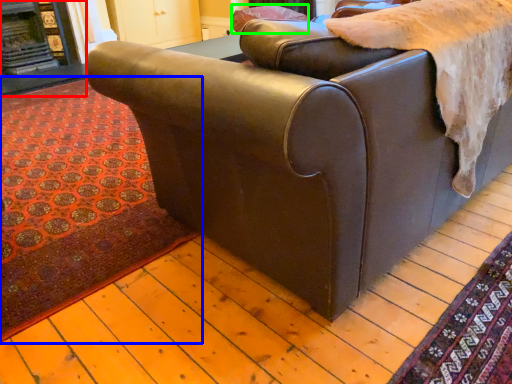
Question: Considering the real-world distances, which object is closest to fireplace (highlighted by a red box)? mat (highlighted by a blue box) or pillow (highlighted by a green box).

Choices:
 (A) mat
 (B) pillow

Answer: (A)